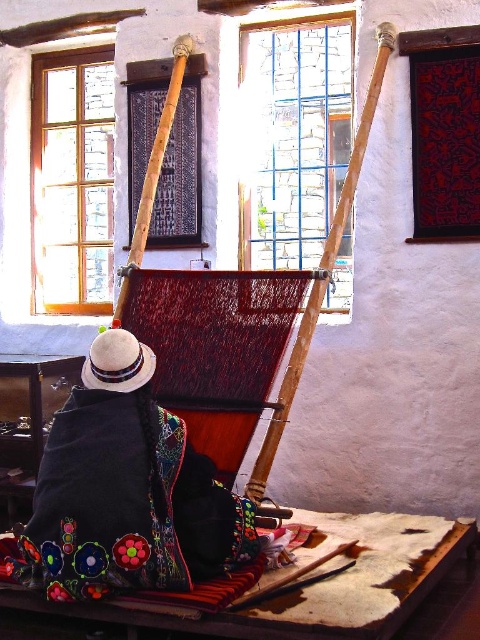
Which is in front, point (34, 556) or point (87, 371)?

Point (34, 556) is in front.

Measure the distance between embroidered fabric at lower left and camera.

embroidered fabric at lower left and camera are 2.40 meters apart from each other.

Identify the location of embroidered fabric at lower left. (108, 483).